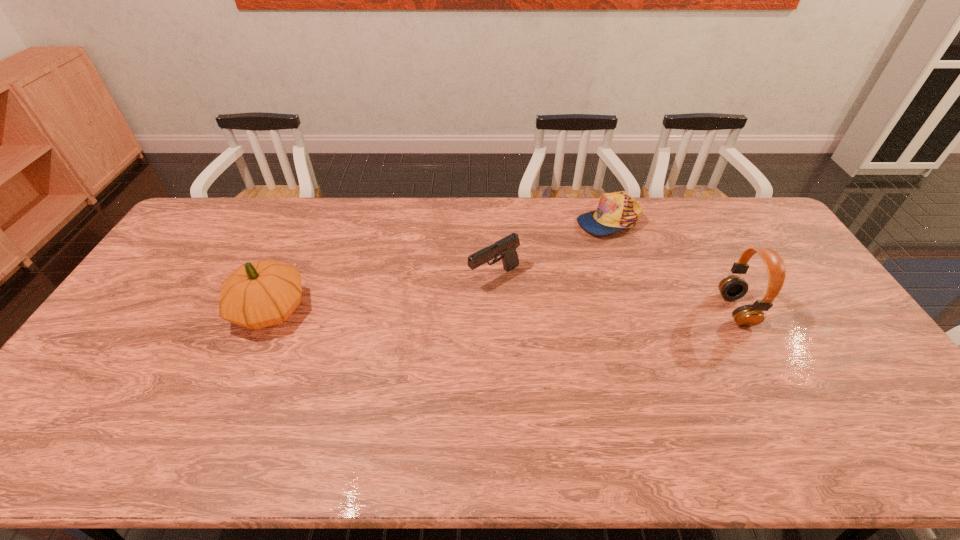
The width and height of the screenshot is (960, 540). Identify the location of vacant space on the desktop that is between the third shortest object and the headset and is positioned aim along the barrel of the third tallest object. (435, 309).

The width and height of the screenshot is (960, 540). In order to click on free space on the desktop that is between the second tallest object and the rightmost object and is positioned on the bill of the shortest object in this screenshot , I will do `click(534, 310)`.